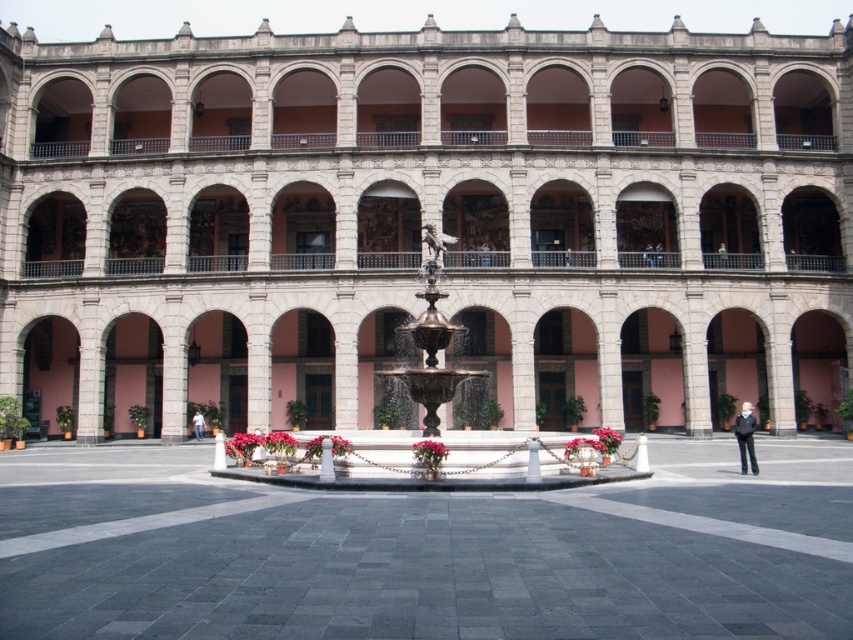
You are standing at point A located at coordinates (422, 220) in the courtyard of the grand historical building. What object is precisely at your current location?

The stone fountain at center is precisely at point A located at coordinates (422, 220) in the courtyard of the grand historical building.

You are standing in the courtyard of the historical building and want to walk from the point marked by coordinates point (445, 326) to the point marked by coordinates point (604, 442). Which direction should you move to reach your destination?

Since point (445, 326) is behind point (604, 442), you should move forward to reach the destination.